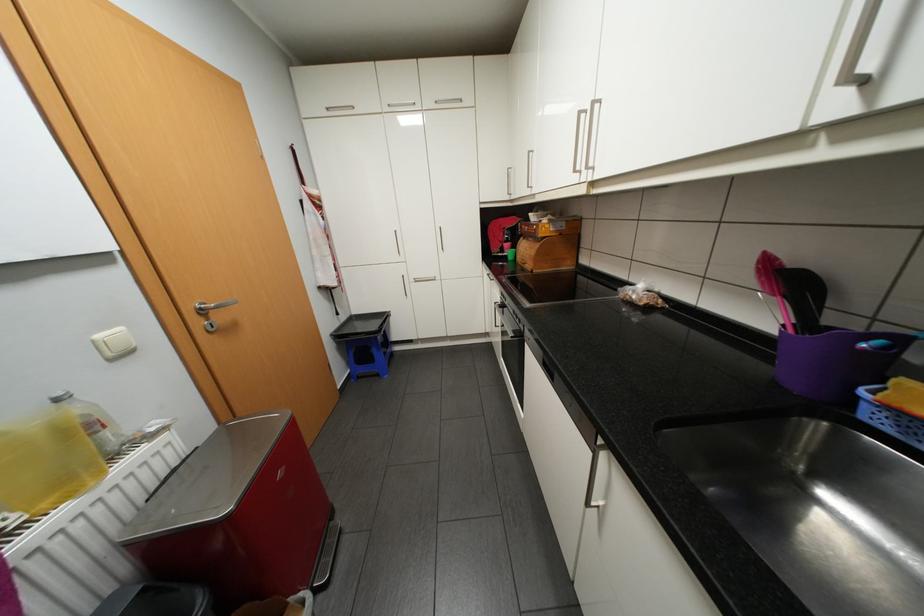
At what (x,y) coordinates should I click in order to perform the action: click on oven door handle. Please return your answer as a coordinate pair (x, y). Image resolution: width=924 pixels, height=616 pixels. Looking at the image, I should click on (503, 320).